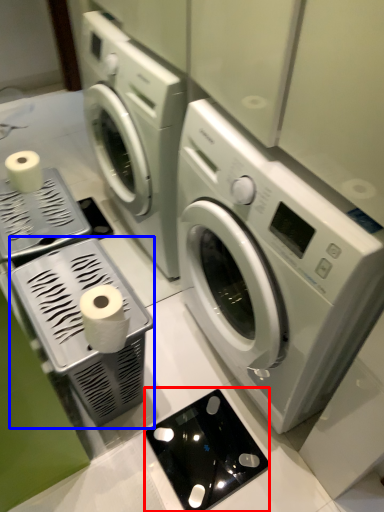
Question: Which point is further to the camera, appliance (highlighted by a red box) or appliance (highlighted by a blue box)?

Choices:
 (A) appliance
 (B) appliance

Answer: (A)